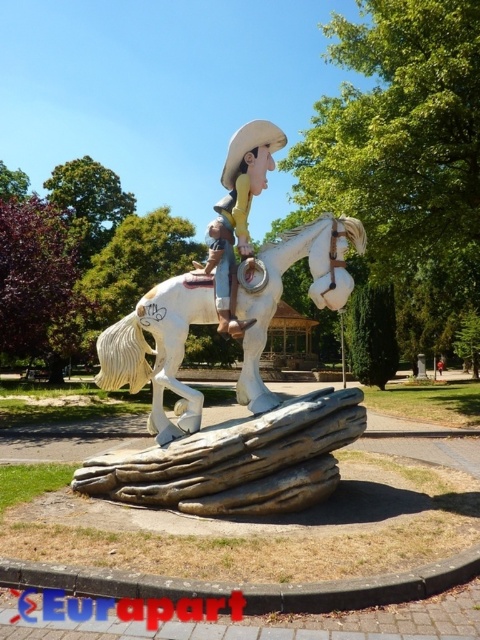
You are an art student analyzing the sculpture. You notice the white glossy horse at center and the matte yellow cowboy hat at center. Which object takes up more area in the sculpture?

The matte yellow cowboy hat at center takes up more area in the sculpture than the white glossy horse at center because the white glossy horse at center occupies less space than matte yellow cowboy hat at center.

You are standing at the entrance of the park and see the white glossy horse at center. If you want to walk directly towards it from your current position, which direction should you head?

Since the white glossy horse at center is located at point (158, 349), you should head towards the center of the park to reach it.

You are standing in the park and see the white glossy horse at center and the smooth beige cowboy hat at center. Which object is positioned to the left?

The white glossy horse at center is positioned to the left of the smooth beige cowboy hat at center.